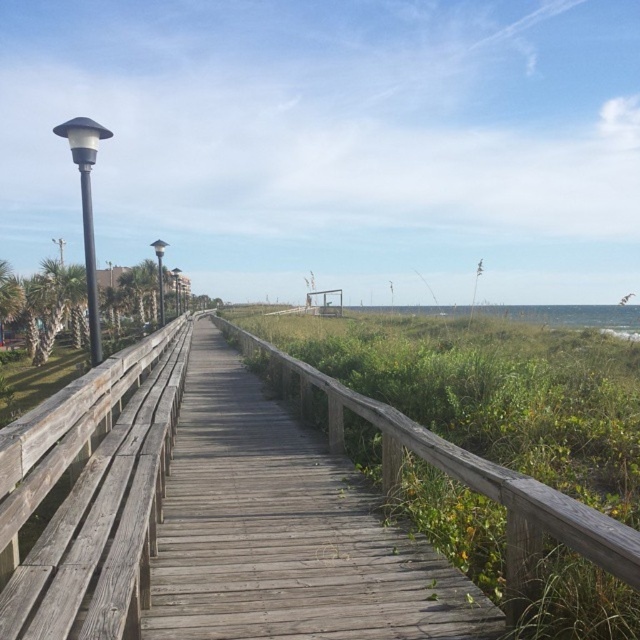
You are standing at the origin point in the image, which is the bottom left corner. The weathered wood boardwalk at center is located at point 0.830 on the x axis and 0.447 on the y axis. If you want to walk towards the boardwalk, which direction should you move in terms of x and y coordinates?

To reach the weathered wood boardwalk at center located at coordinates x 0.830 and y 0.447 from the origin at bottom left corner, you should move in the positive x direction and positive y direction since both coordinates are greater than zero.

You are a maintenance worker tasked with checking the height of the weathered wood boardwalk at center and the weathered wood rail at left. Which one is shorter?

The weathered wood boardwalk at center is shorter than the weathered wood rail at left.